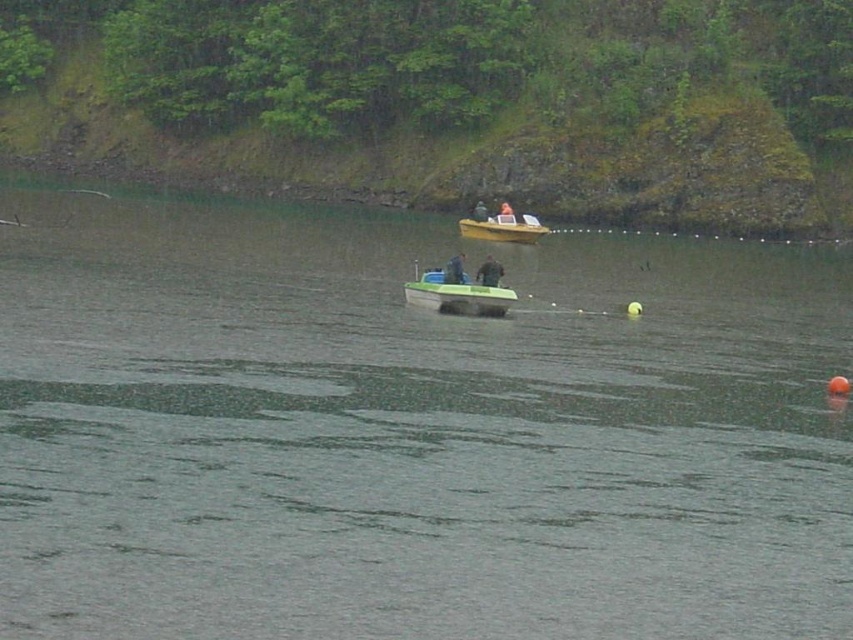
You are a photographer trying to capture a clear image of the yellow plastic boat at center and the smooth skin face at center. Which object should you focus on first if you want the other to be in the background?

You should focus on the yellow plastic boat at center first because it is in front of the smooth skin face at center, so if you focus on the boat, the face will naturally be in the background.

You are a photographer trying to capture a clear shot of both the smooth skin face at center and the smooth yellow boat at center. Which object will appear larger in your photo?

The smooth skin face at center will appear larger in the photo because it is closer to the viewer than the smooth yellow boat at center.

You are a photographer trying to capture a clear shot of the yellow plastic boat at center and the dark green fabric jacket at center. Since you want to focus on the boat, which object should you adjust your camera lens to prioritize in terms of height?

The yellow plastic boat at center is taller than the dark green fabric jacket at center, so you should adjust your camera lens to prioritize the yellow plastic boat at center due to its greater height.